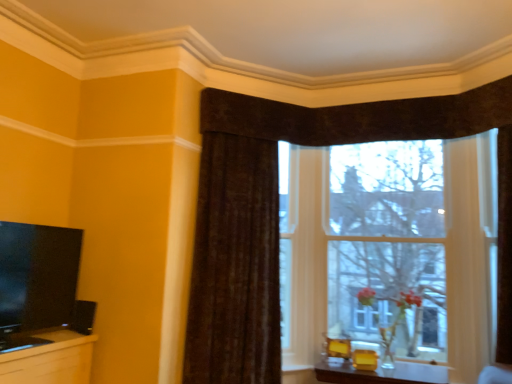
What do you see at coordinates (380, 373) in the screenshot? I see `matte yellow table at lower center` at bounding box center [380, 373].

This screenshot has width=512, height=384. Describe the element at coordinates (36, 281) in the screenshot. I see `matte black tv at left` at that location.

Measure the distance between brown textured curtain at upper center and camera.

3.12 meters.

This screenshot has height=384, width=512. I want to click on transparent glass window at center, so click(361, 247).

Which object is positioned more to the left, brown textured curtain at upper center or matte yellow table at lower center?

Positioned to the left is brown textured curtain at upper center.

Is matte yellow table at lower center at the back of brown textured curtain at upper center?

No, brown textured curtain at upper center is not facing away from matte yellow table at lower center.

Can matte yellow table at lower center be found inside brown textured curtain at upper center?

No, matte yellow table at lower center is not inside brown textured curtain at upper center.

Between point (230, 229) and point (413, 365), which one is positioned in front?

The point (230, 229) is closer.

Is matte black tv at left completely or partially outside of matte yellow table at lower center?

Yes.

Considering the positions of point (24, 262) and point (348, 381), is point (24, 262) closer or farther from the camera than point (348, 381)?

Point (24, 262) appears to be closer to the viewer than point (348, 381).

Does matte black tv at left have a lesser height compared to matte yellow table at lower center?

In fact, matte black tv at left may be taller than matte yellow table at lower center.

Considering the relative sizes of matte black tv at left and matte yellow table at lower center in the image provided, is matte black tv at left smaller than matte yellow table at lower center?

Yes, matte black tv at left is smaller than matte yellow table at lower center.

Which point is more forward, (24, 299) or (255, 305)?

The point (24, 299) is more forward.

The height and width of the screenshot is (384, 512). Identify the location of curtain that appears above the matte black tv at left (from a real-world perspective). (234, 265).

Can you confirm if matte black tv at left is wider than brown textured curtain at upper center?

In fact, matte black tv at left might be narrower than brown textured curtain at upper center.

Is matte black tv at left located outside brown textured curtain at upper center?

matte black tv at left is positioned outside brown textured curtain at upper center.

Considering the sizes of objects matte black tv at left and transparent glass window at center in the image provided, who is taller, matte black tv at left or transparent glass window at center?

Standing taller between the two is transparent glass window at center.

Looking at their sizes, would you say matte black tv at left is wider or thinner than transparent glass window at center?

matte black tv at left is thinner than transparent glass window at center.

Is matte black tv at left turned away from transparent glass window at center?

That's not correct — matte black tv at left is not looking away from transparent glass window at center.

Does matte black tv at left touch transparent glass window at center?

matte black tv at left is not next to transparent glass window at center, and they're not touching.

How many degrees apart are the facing directions of transparent glass window at center and brown textured curtain at upper center?

There is a 43.2-degree angle between the facing directions of transparent glass window at center and brown textured curtain at upper center.

Based on the photo, are transparent glass window at center and brown textured curtain at upper center far apart?

No, there isn't a large distance between transparent glass window at center and brown textured curtain at upper center.

From the image's perspective, which is below, transparent glass window at center or brown textured curtain at upper center?

brown textured curtain at upper center, from the image's perspective.

Is transparent glass window at center closer to the viewer compared to brown textured curtain at upper center?

No, it is behind brown textured curtain at upper center.

From a real-world perspective, between transparent glass window at center and matte yellow table at lower center, who is vertically higher?

In real-world perspective, transparent glass window at center is above.

Is transparent glass window at center not within matte yellow table at lower center?

Yes, transparent glass window at center is outside of matte yellow table at lower center.

Can you confirm if brown textured curtain at upper center is bigger than matte black tv at left?

Yes, brown textured curtain at upper center is bigger than matte black tv at left.

From the image's perspective, is brown textured curtain at upper center below matte black tv at left?

No, from the image's perspective, brown textured curtain at upper center is not below matte black tv at left.

Which is more to the right, brown textured curtain at upper center or matte black tv at left?

From the viewer's perspective, brown textured curtain at upper center appears more on the right side.

Which of these two, brown textured curtain at upper center or matte black tv at left, stands shorter?

Standing shorter between the two is matte black tv at left.

The width and height of the screenshot is (512, 384). What are the coordinates of `table below the brown textured curtain at upper center (from a real-world perspective)` in the screenshot? It's located at (380, 373).

The image size is (512, 384). In order to click on television that is in front of the matte yellow table at lower center in this screenshot , I will do `click(36, 281)`.

Based on their spatial positions, is matte yellow table at lower center or brown textured curtain at upper center further from transparent glass window at center?

Among the two, matte yellow table at lower center is located further to transparent glass window at center.

Based on their spatial positions, is brown textured curtain at upper center or matte yellow table at lower center further from matte black tv at left?

matte yellow table at lower center lies further to matte black tv at left than the other object.

Based on their spatial positions, is matte black tv at left or brown textured curtain at upper center further from transparent glass window at center?

Among the two, matte black tv at left is located further to transparent glass window at center.

Looking at the image, which one is located further to brown textured curtain at upper center, transparent glass window at center or matte black tv at left?

The object further to brown textured curtain at upper center is matte black tv at left.

In the scene shown: Which object lies further to the anchor point brown textured curtain at upper center, matte black tv at left or matte yellow table at lower center?

Based on the image, matte black tv at left appears to be further to brown textured curtain at upper center.

When comparing their distances from matte yellow table at lower center, does matte black tv at left or transparent glass window at center seem closer?

transparent glass window at center is positioned closer to the anchor matte yellow table at lower center.

Based on their spatial positions, is matte black tv at left or matte yellow table at lower center closer to transparent glass window at center?

Based on the image, matte yellow table at lower center appears to be nearer to transparent glass window at center.

From the image, which object appears to be farther from matte black tv at left, matte yellow table at lower center or brown textured curtain at upper center?

matte yellow table at lower center is positioned further to the anchor matte black tv at left.

Identify the location of curtain located between matte black tv at left and transparent glass window at center in the left-right direction. The height and width of the screenshot is (384, 512). (234, 265).

Find the location of `table situated between matte black tv at left and transparent glass window at center from left to right`. table situated between matte black tv at left and transparent glass window at center from left to right is located at coordinates (380, 373).

Locate an element on the screen. The image size is (512, 384). curtain situated between matte black tv at left and matte yellow table at lower center from left to right is located at coordinates (234, 265).

Find the location of a particular element. The height and width of the screenshot is (384, 512). table located between brown textured curtain at upper center and transparent glass window at center in the left-right direction is located at coordinates (380, 373).